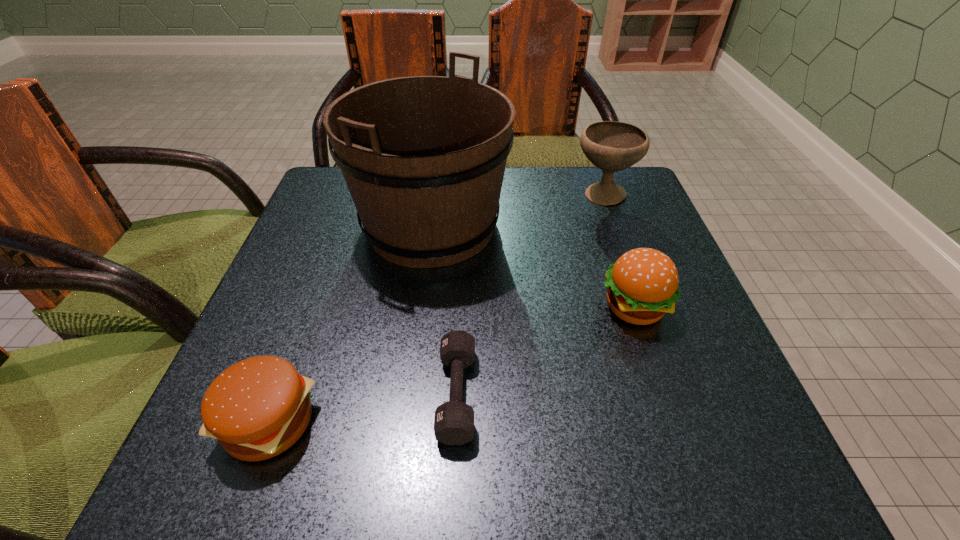
Identify the location of object that is the second closest to the shortest object. click(257, 408).

Find the location of a particular element. The width and height of the screenshot is (960, 540). vacant space that satisfies the following two spatial constraints: 1. on the back side of the nearer hamburger; 2. on the right side of the second tallest object is located at coordinates (353, 195).